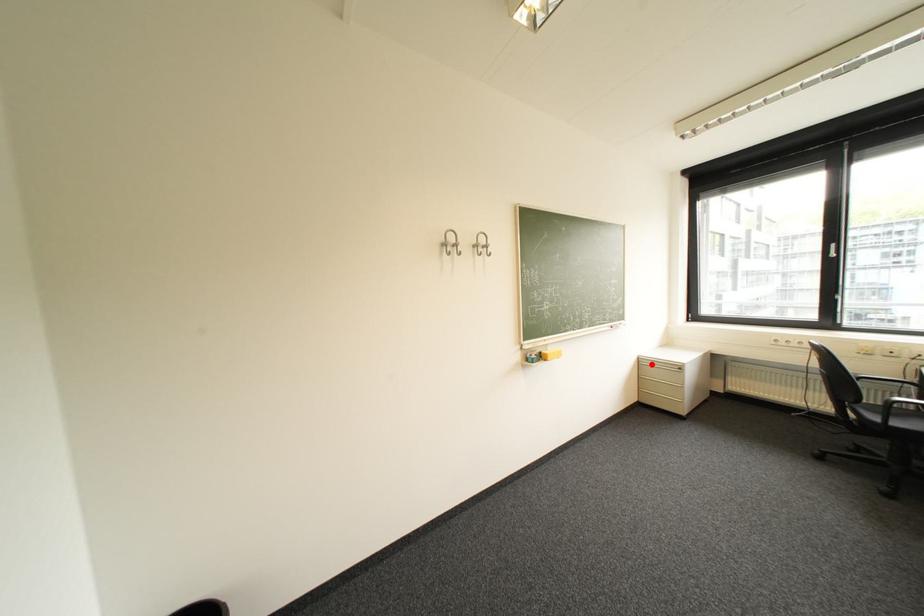
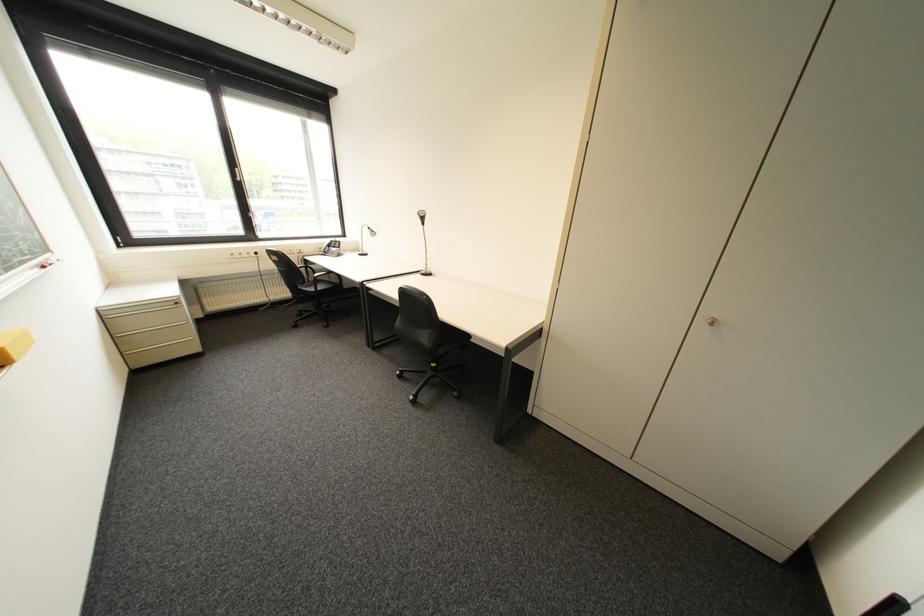
The point at the highlighted location is marked in the first image. Where is the corresponding point in the second image?

(119, 318)